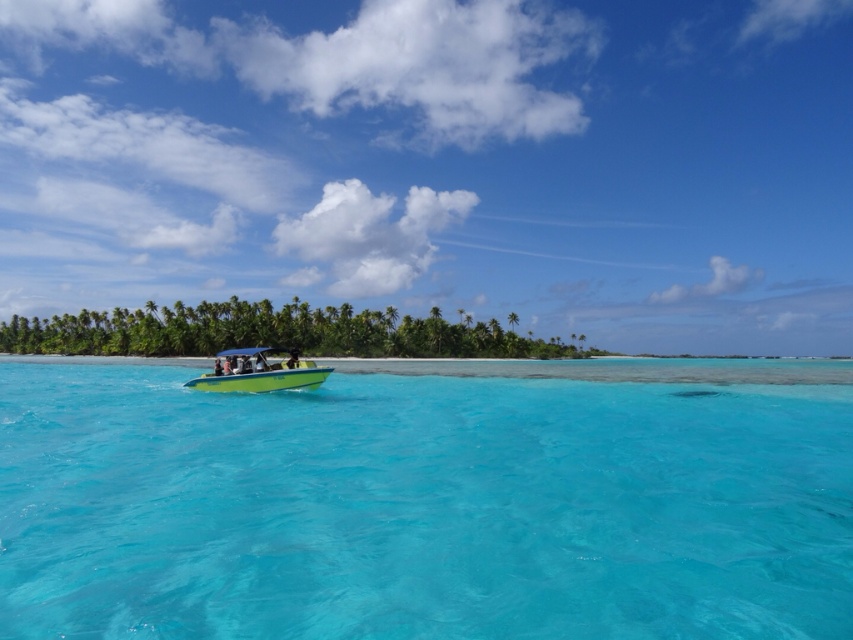
Question: Among these objects, which one is farthest from the camera?

Choices:
 (A) transparent blue water at center
 (B) green plastic boat at center

Answer: (B)

Question: Can you confirm if transparent blue water at center is positioned to the right of green plastic boat at center?

Choices:
 (A) no
 (B) yes

Answer: (B)

Question: Which point appears farthest from the camera in this image?

Choices:
 (A) (222, 376)
 (B) (379, 513)

Answer: (A)

Question: Is transparent blue water at center above green plastic boat at center?

Choices:
 (A) yes
 (B) no

Answer: (B)

Question: Where is transparent blue water at center located in relation to green plastic boat at center in the image?

Choices:
 (A) right
 (B) left

Answer: (A)